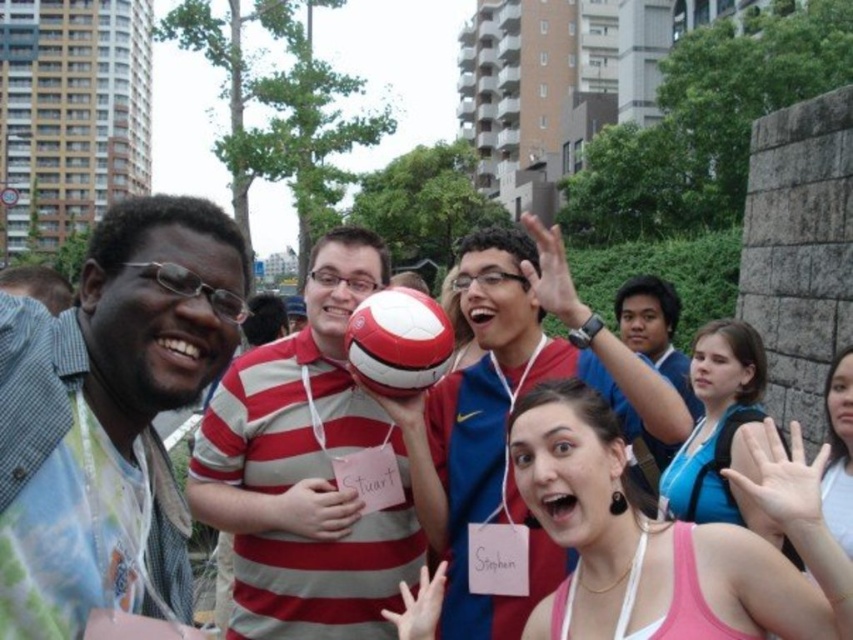
You are a soccer coach preparing for a training session. You have two soccer balls available in the center of the field. One is the red and white soccer ball at center and the other is the white matte soccer ball at center. Which soccer ball should you choose if you want to use the larger one for the training?

The red and white soccer ball at center has a larger size compared to the white matte soccer ball at center, so you should choose the red and white soccer ball at center for the training.

You are a photographer standing in front of the group. You want to take a photo of the red and white soccer ball at center without the striped cotton polo shirt at center blocking it. Is this possible?

The striped cotton polo shirt at center is further to the viewer than the red and white soccer ball at center, so the striped cotton polo shirt at center is closer to you and would block the soccer ball. To avoid blocking, you need to move your position so that the striped cotton polo shirt at center is no longer in front of the soccer ball.